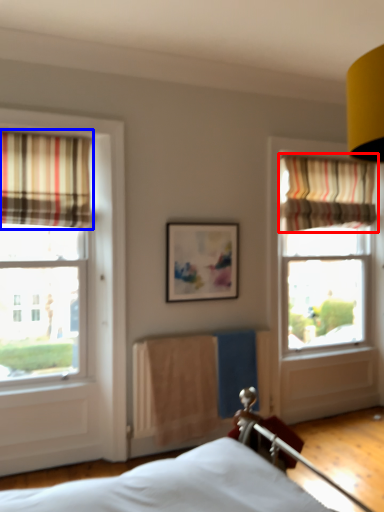
Question: Which object appears farthest to the camera in this image, curtain (highlighted by a red box) or curtain (highlighted by a blue box)?

Choices:
 (A) curtain
 (B) curtain

Answer: (A)